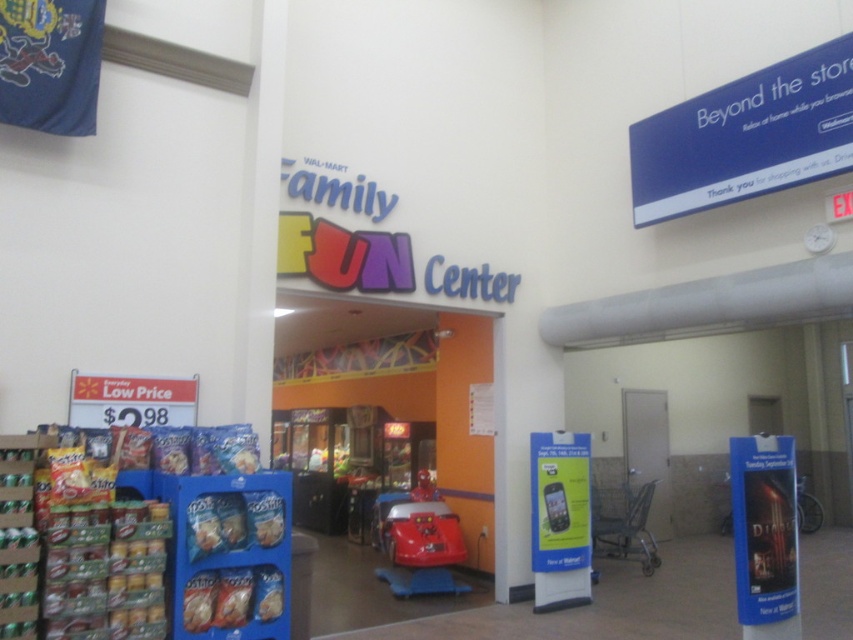
Does yellow glossy phone at center appear under shiny red car at center?

No, yellow glossy phone at center is not below shiny red car at center.

Describe the element at coordinates (560, 500) in the screenshot. I see `yellow glossy phone at center` at that location.

The width and height of the screenshot is (853, 640). What are the coordinates of `yellow glossy phone at center` in the screenshot? It's located at (560, 500).

Which of these two, blue plastic sign at upper right or shiny red car at center, stands shorter?

shiny red car at center

In the scene shown: Does blue plastic sign at upper right appear on the right side of shiny red car at center?

Yes, blue plastic sign at upper right is to the right of shiny red car at center.

Locate an element on the screen. This screenshot has width=853, height=640. blue plastic sign at upper right is located at coordinates (746, 136).

Does point (785, 488) lie in front of point (561, 442)?

Yes, it is.

Does black glossy poster at lower right appear on the right side of yellow glossy phone at center?

Correct, you'll find black glossy poster at lower right to the right of yellow glossy phone at center.

Describe the element at coordinates (764, 529) in the screenshot. The height and width of the screenshot is (640, 853). I see `black glossy poster at lower right` at that location.

Where is `black glossy poster at lower right`? black glossy poster at lower right is located at coordinates (764, 529).